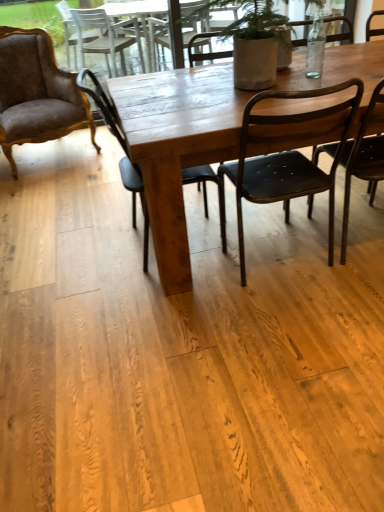
At what (x,y) coordinates should I click in order to perform the action: click on vacant space in front of wooden table at center. Please return your answer as a coordinate pair (x, y). The width and height of the screenshot is (384, 512). Looking at the image, I should click on (246, 373).